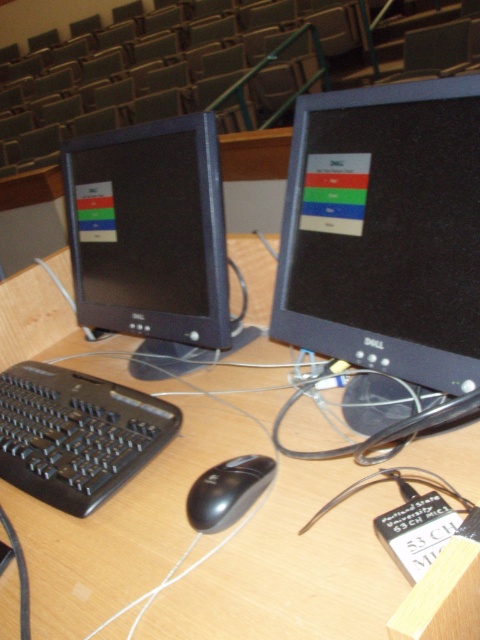
You are a technician trying to organize the cables between the matte black monitor at left and the black matte mouse at center. If the cable you have is 18 inches long, will it be sufficient to connect them without needing an extension?

The matte black monitor at left is 18.60 inches from the black matte mouse at center. The cable is only 18 inches long, which is 0.60 inches shorter than needed, so it will not be sufficient without an extension.

You are a technician trying to organize the desk. You have a matte black monitor at center and a black matte mouse at center. Which object has a greater width?

The matte black monitor at center has a greater width than the black matte mouse at center.